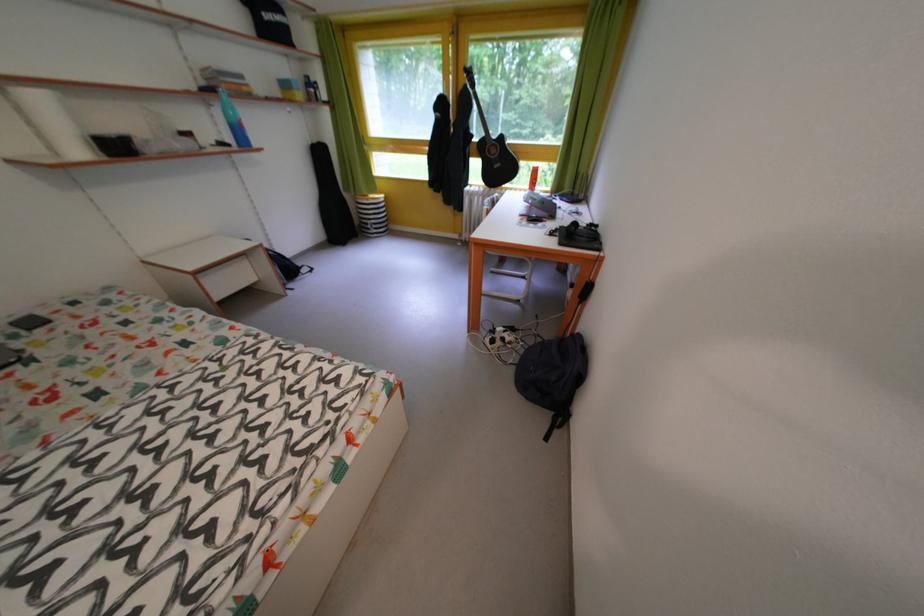
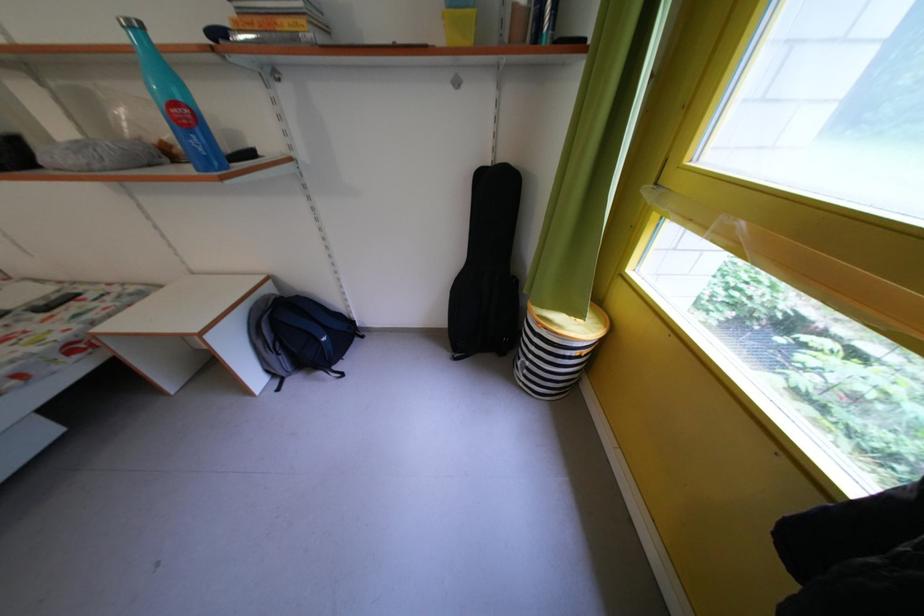
The point at (383, 227) is marked in the first image. Where is the corresponding point in the second image?

(537, 369)